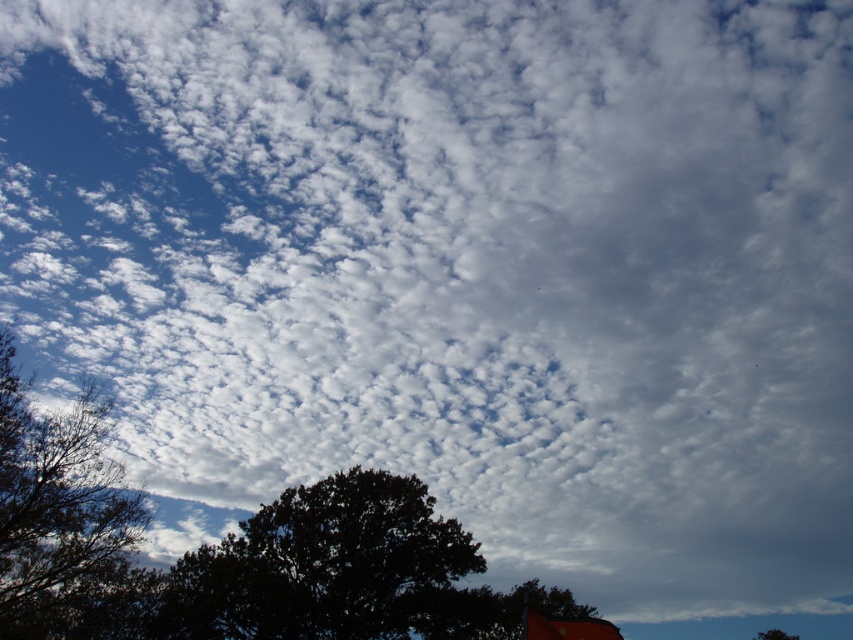
Question: Is orange fabric flag at lower right to the right of dark green leafy tree at bottom from the viewer's perspective?

Choices:
 (A) no
 (B) yes

Answer: (A)

Question: Where is orange fabric flag at lower right located in relation to dark green leafy tree at bottom in the image?

Choices:
 (A) below
 (B) above

Answer: (B)

Question: Which object is positioned farthest from the dark green leafy tree at bottom?

Choices:
 (A) dark green leafy tree at left
 (B) orange fabric flag at lower right

Answer: (A)

Question: Which of the following is the closest to the observer?

Choices:
 (A) (566, 621)
 (B) (132, 621)
 (C) (785, 634)

Answer: (A)

Question: Estimate the real-world distances between objects in this image. Which object is closer to the dark green leafy tree at left?

Choices:
 (A) dark green leafy tree at bottom
 (B) orange fabric flag at lower right

Answer: (B)

Question: Is dark green leafy tree at left positioned at the back of orange fabric flag at lower right?

Choices:
 (A) no
 (B) yes

Answer: (B)